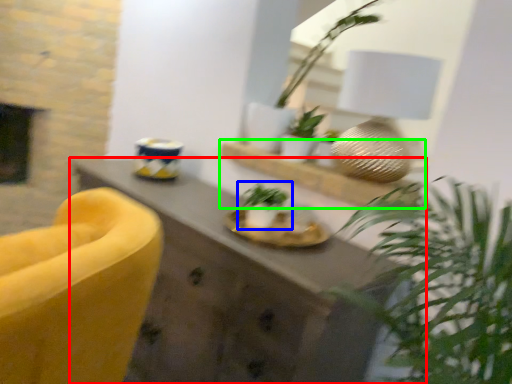
Question: Which is farther away from desk (highlighted by a red box)? houseplant (highlighted by a blue box) or shelf (highlighted by a green box)?

Choices:
 (A) houseplant
 (B) shelf

Answer: (B)